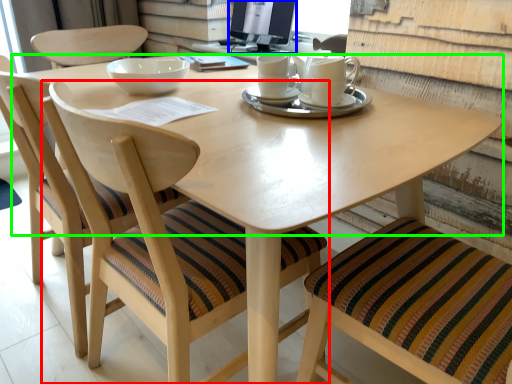
Question: Which is farther away from chair (highlighted by a red box)? computer monitor (highlighted by a blue box) or round table (highlighted by a green box)?

Choices:
 (A) computer monitor
 (B) round table

Answer: (A)